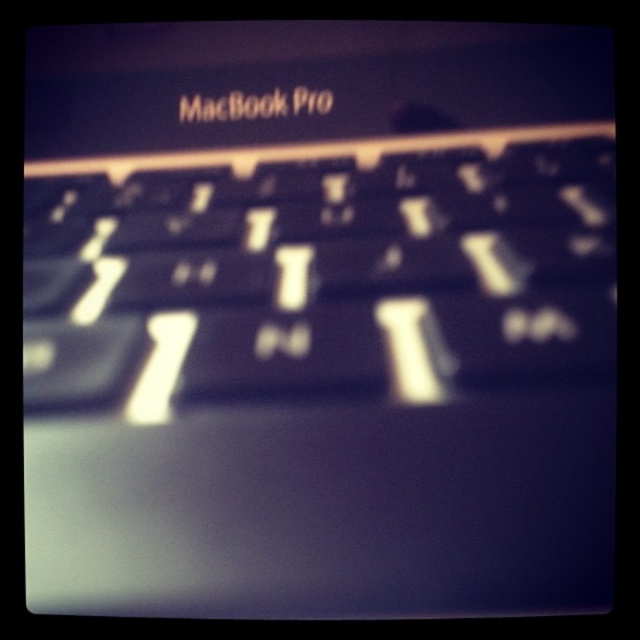
Question: Can you confirm if black matte keyboard at center is positioned to the right of black plastic macbook pro at upper center?

Choices:
 (A) no
 (B) yes

Answer: (B)

Question: Is black matte keyboard at center to the right of black plastic macbook pro at upper center from the viewer's perspective?

Choices:
 (A) no
 (B) yes

Answer: (B)

Question: Which object is closer to the camera taking this photo?

Choices:
 (A) black plastic macbook pro at upper center
 (B) black matte keyboard at center

Answer: (B)

Question: Which point is closer to the camera taking this photo?

Choices:
 (A) (579, 218)
 (B) (330, 33)

Answer: (A)

Question: Is black matte keyboard at center to the right of black plastic macbook pro at upper center from the viewer's perspective?

Choices:
 (A) yes
 (B) no

Answer: (A)

Question: Among these objects, which one is farthest from the camera?

Choices:
 (A) black matte keyboard at center
 (B) black plastic macbook pro at upper center

Answer: (B)